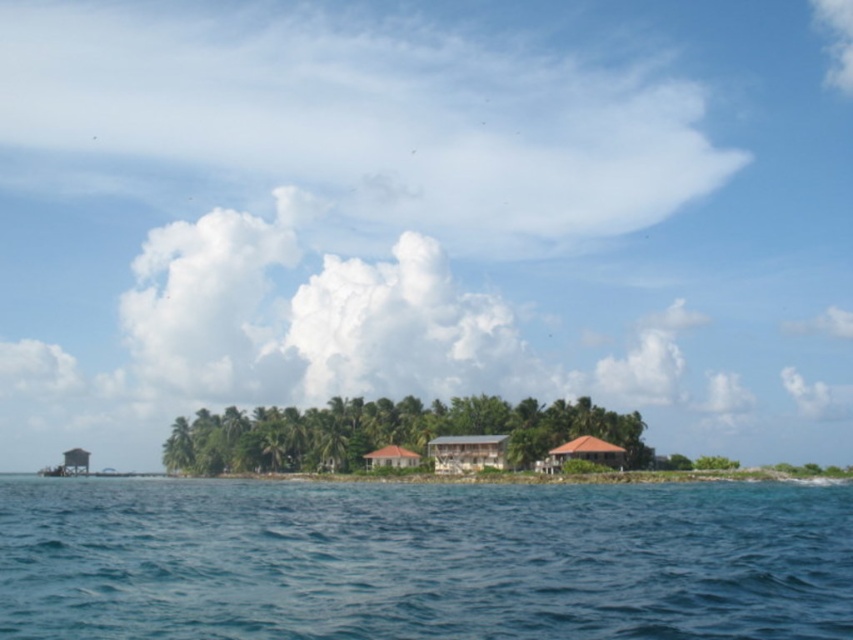
Question: Which object appears farthest from the camera in this image?

Choices:
 (A) brown thatched roof hut at center
 (B) brown wooden hut at center
 (C) blue water at lower center
 (D) wooden hut at lower left

Answer: (D)

Question: Among these objects, which one is farthest from the camera?

Choices:
 (A) wooden hut at lower left
 (B) brown thatched roof hut at center

Answer: (A)

Question: Which point is farther to the camera?

Choices:
 (A) brown thatched roof hut at center
 (B) wooden hut at lower left
 (C) brown wooden hut at center
 (D) blue water at lower center

Answer: (B)

Question: Does brown wooden hut at center appear on the left side of wooden hut at lower left?

Choices:
 (A) yes
 (B) no

Answer: (B)

Question: Is brown wooden hut at center to the left of brown corrugated metal hut at center from the viewer's perspective?

Choices:
 (A) yes
 (B) no

Answer: (B)

Question: Does blue water at lower center have a larger size compared to wooden hut at lower left?

Choices:
 (A) no
 (B) yes

Answer: (A)